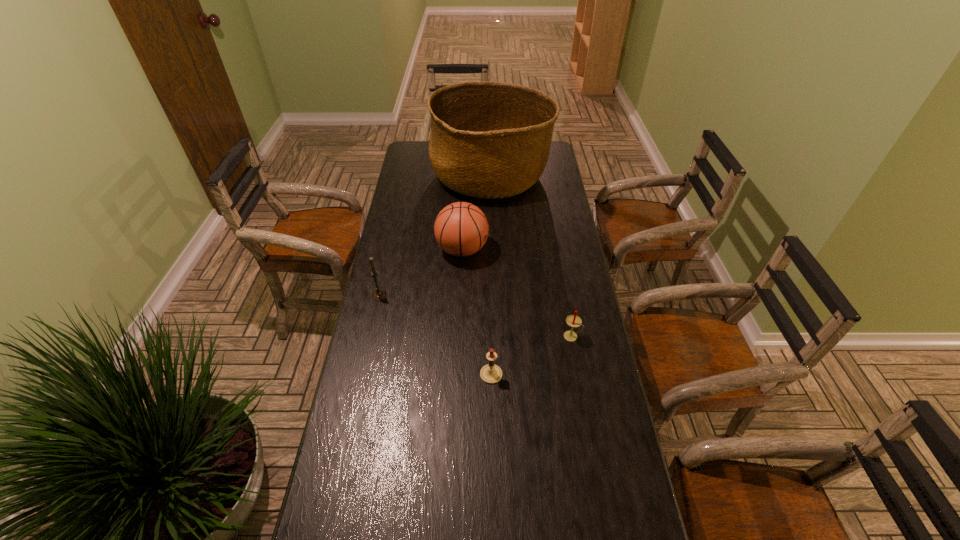
Where is `vacant space that's between the leftmost object and the fourth nearest object`? The image size is (960, 540). vacant space that's between the leftmost object and the fourth nearest object is located at coordinates (420, 273).

Identify the location of the closest object to the second candle from right to left. The height and width of the screenshot is (540, 960). (573, 321).

Locate which object is the closest to the second nearest object. Please provide its 2D coordinates. Your answer should be formatted as a tuple, i.e. [(x, y)], where the tuple contains the x and y coordinates of a point satisfying the conditions above.

[(491, 373)]

Select which candle appears as the closest to the second farthest candle. Please provide its 2D coordinates. Your answer should be formatted as a tuple, i.e. [(x, y)], where the tuple contains the x and y coordinates of a point satisfying the conditions above.

[(491, 373)]

Select which candle is the second closest to the fourth farthest object. Please provide its 2D coordinates. Your answer should be formatted as a tuple, i.e. [(x, y)], where the tuple contains the x and y coordinates of a point satisfying the conditions above.

[(379, 294)]

At what (x,y) coordinates should I click in order to perform the action: click on vacant space that satisfies the following two spatial constraints: 1. on the surface of the fourth nearest object near the brand logo; 2. on the left side of the second farthest candle. Please return your answer as a coordinate pair (x, y). Looking at the image, I should click on (459, 336).

Identify the location of free space that satisfies the following two spatial constraints: 1. on the front side of the farthest object; 2. on the right side of the rightmost candle. (495, 336).

Locate an element on the screen. free region that satisfies the following two spatial constraints: 1. on the front side of the second candle from left to right; 2. on the left side of the leftmost object is located at coordinates (362, 374).

Locate an element on the screen. vacant area in the image that satisfies the following two spatial constraints: 1. on the surface of the basketball near the brand logo; 2. on the left side of the second candle from right to left is located at coordinates (457, 374).

Identify the location of free spot that satisfies the following two spatial constraints: 1. on the front side of the tallest object; 2. on the right side of the second farthest candle. (495, 336).